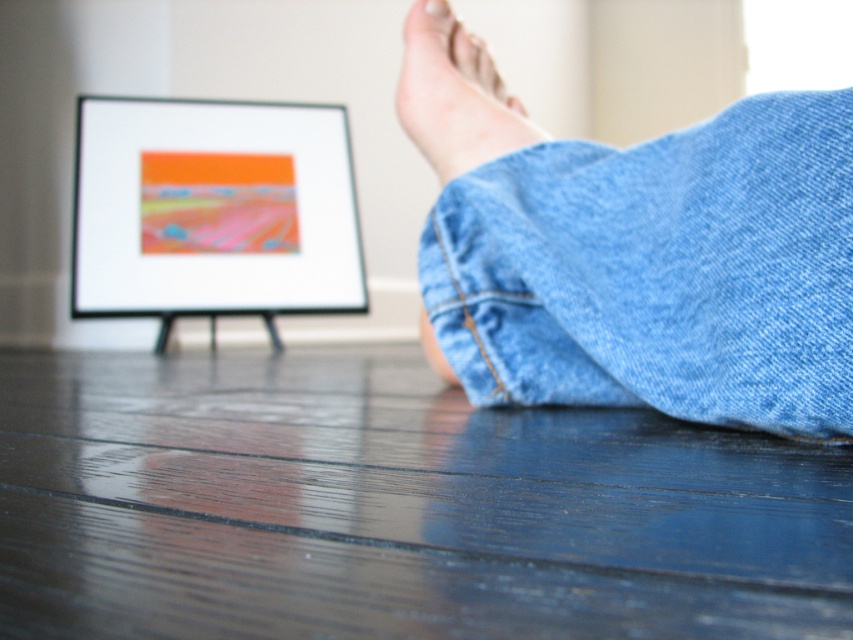
You are designing a new pair of socks that need to fit both the denim at lower right and the smooth skin foot at center. Based on the scene, which object requires a wider sock design?

The denim at lower right requires a wider sock design because its width is larger than the smooth skin foot at center.

You are an interior designer assessing the placement of the matte black picture frame at upper center and the smooth skin foot at center in the image. Based on their current positions, which object is covering the other?

The matte black picture frame at upper center is positioned over the smooth skin foot at center, so it is covering it.